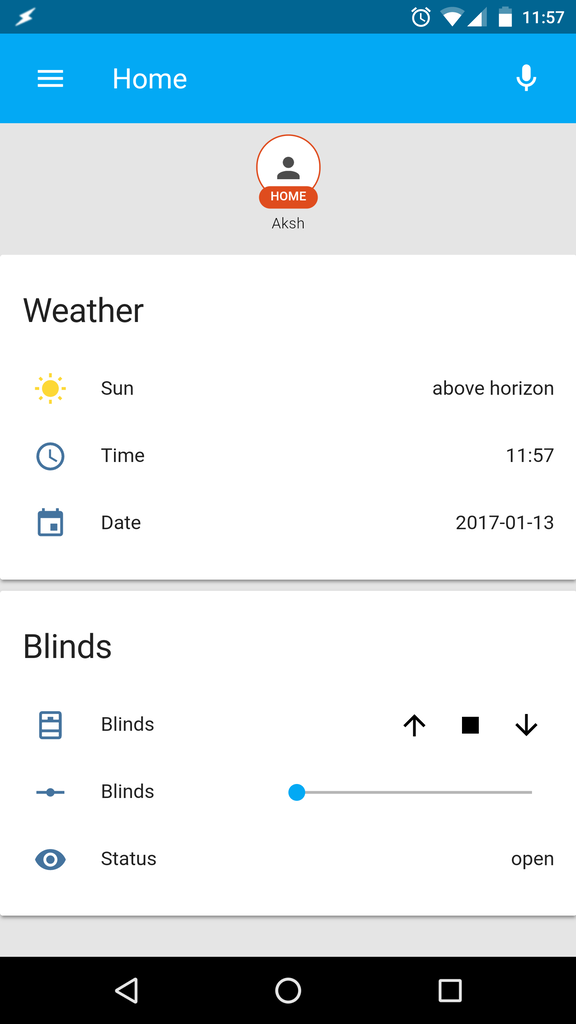
Locate an element on the screen. Image resolution: width=576 pixels, height=1024 pixels. alarm is located at coordinates (420, 18).